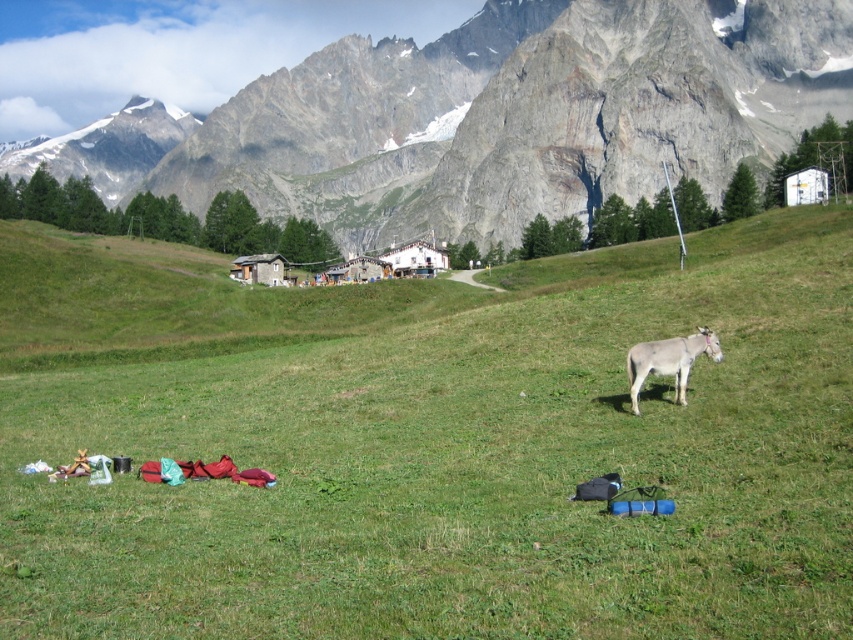
Question: Which point appears farthest from the camera in this image?

Choices:
 (A) (830, 20)
 (B) (688, 344)

Answer: (A)

Question: Is rocky gray mountain at upper center behind white matte donkey at right?

Choices:
 (A) yes
 (B) no

Answer: (A)

Question: Which of these objects is positioned farthest from the rocky gray mountain at upper center?

Choices:
 (A) green grass pasture at center
 (B) white matte donkey at right

Answer: (B)

Question: Does green grass pasture at center appear under white matte donkey at right?

Choices:
 (A) no
 (B) yes

Answer: (A)

Question: Is green grass pasture at center closer to camera compared to rocky gray mountain at upper center?

Choices:
 (A) no
 (B) yes

Answer: (B)

Question: Which point is farther from the camera taking this photo?

Choices:
 (A) (630, 371)
 (B) (373, 138)

Answer: (B)